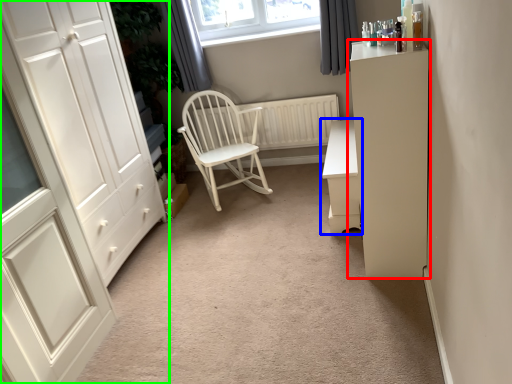
Question: Estimate the real-world distances between objects in this image. Which object is closer to cabinetry (highlighted by a red box), chest of drawers (highlighted by a blue box) or cupboard (highlighted by a green box)?

Choices:
 (A) chest of drawers
 (B) cupboard

Answer: (A)